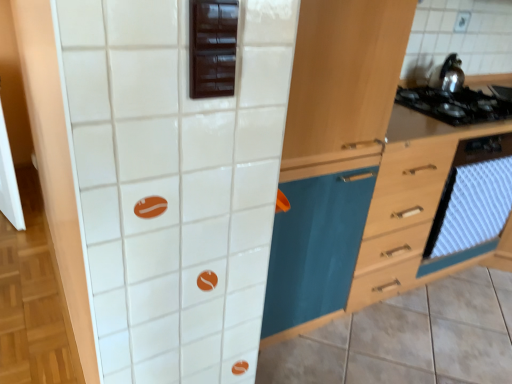
Locate an element on the screen. unoccupied area in front of shiny metallic kettle at upper right is located at coordinates (452, 102).